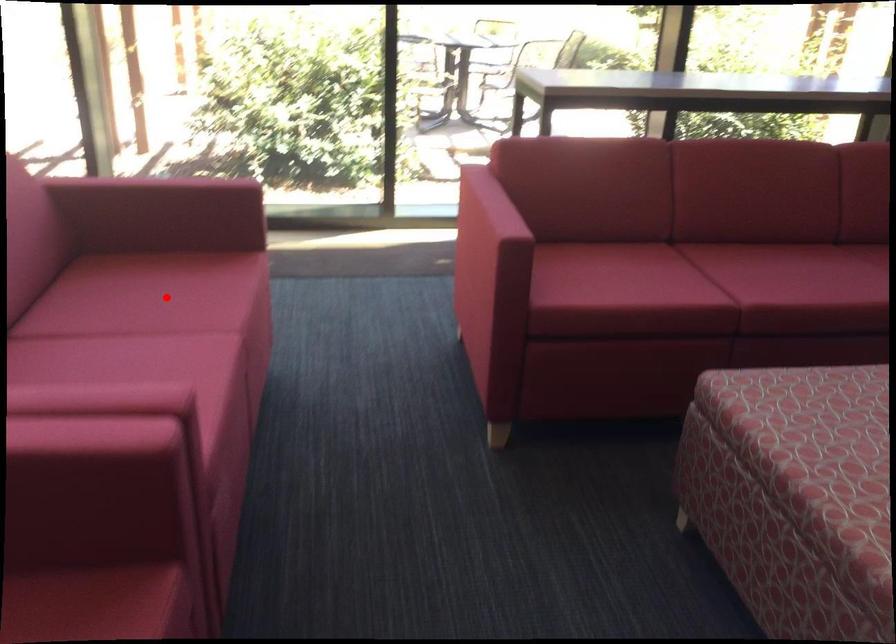
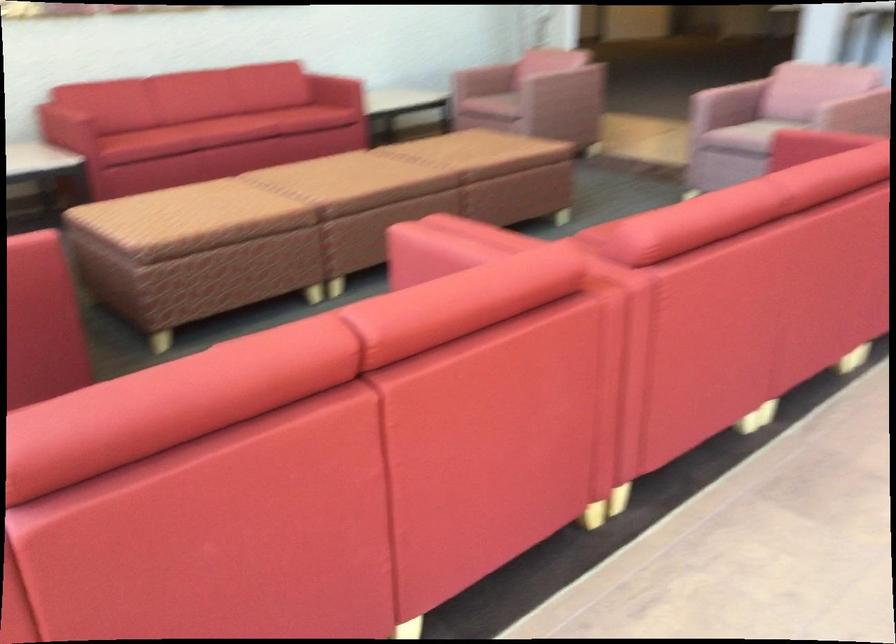
Question: I am providing you with two images of the same scene from different viewpoints. A red point is marked on the first image. Is the red point's position out of view in image 2?

Choices:
 (A) Yes
 (B) No

Answer: (A)